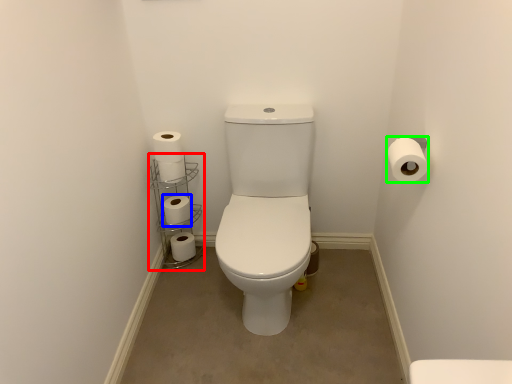
Question: Which object is positioned farthest from shelf (highlighted by a red box)? Select from toilet paper (highlighted by a blue box) and toilet paper (highlighted by a green box).

Choices:
 (A) toilet paper
 (B) toilet paper

Answer: (B)